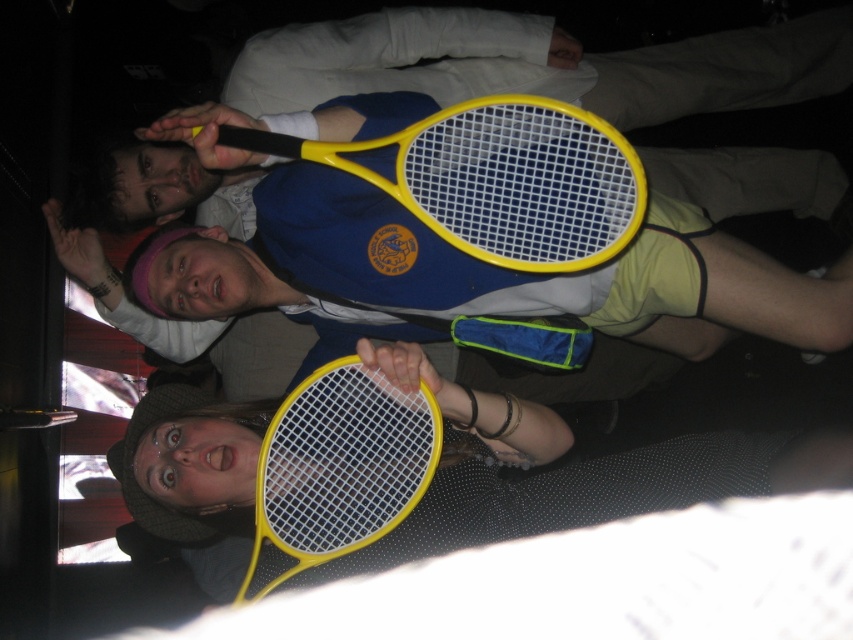
You are playing a game where you need to grab the closest racket to you. Which racket should you choose between the yellow plastic racket at upper center and the yellow plastic racket at lower center?

The yellow plastic racket at upper center is closer to the viewer, so you should choose the yellow plastic racket at upper center.

You are standing in the room and want to locate the yellow plastic racket at upper center. According to the coordinates given, where would you look to find it?

The yellow plastic racket at upper center is located at coordinates point (496, 179).

You are organizing a tennis tournament and need to place two yellow plastic rackets in a display case. The case has a shelf that can only hold items spaced exactly 15 inches apart. Can the yellow plastic racket at upper center and yellow plastic racket at lower center be placed on this shelf without adjusting their positions?

The distance between the yellow plastic racket at upper center and yellow plastic racket at lower center is 15.33 inches, which is slightly more than the 15 inches required by the shelf. Therefore, they cannot be placed on the shelf without adjusting their positions.